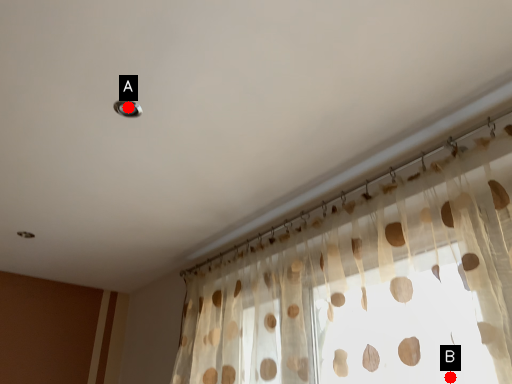
Question: Two points are circled on the image, labeled by A and B beside each circle. Which point is farther from the camera taking this photo?

Choices:
 (A) A is further
 (B) B is further

Answer: (A)